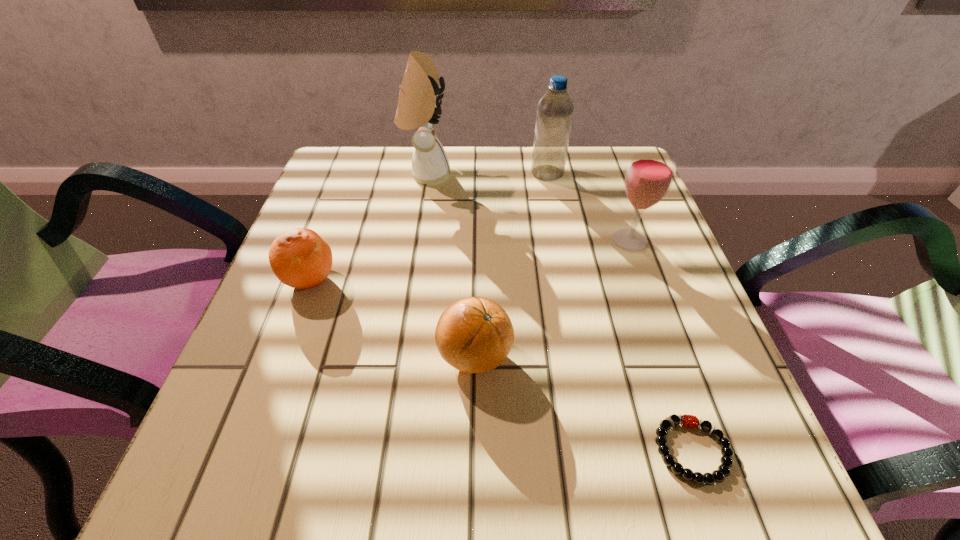
Where is `vacant point located between the water bottle and the nearest object`? The width and height of the screenshot is (960, 540). vacant point located between the water bottle and the nearest object is located at coordinates [x=620, y=312].

Identify the location of object that stands as the second closest to the right orange. (300, 258).

What are the coordinates of `object that is the fifth closest one to the fifth farthest object` in the screenshot? It's located at (555, 109).

Locate an element on the screen. This screenshot has width=960, height=540. vacant space that satisfies the following two spatial constraints: 1. at the front face of the doll; 2. on the back side of the wineglass is located at coordinates (417, 240).

I want to click on free spot that satisfies the following two spatial constraints: 1. at the front face of the shortest object; 2. on the right side of the doll, so click(x=384, y=450).

I want to click on free space that satisfies the following two spatial constraints: 1. at the front face of the fifth object from right to left; 2. on the left side of the fourth nearest object, so click(x=417, y=240).

Locate an element on the screen. vacant area in the image that satisfies the following two spatial constraints: 1. on the front side of the fifth shortest object; 2. on the right side of the wineglass is located at coordinates (560, 240).

You are a GUI agent. You are given a task and a screenshot of the screen. Output one action in this format:
    pyautogui.click(x=<x>, y=<y>)
    Task: Click on the free spot that satisfies the following two spatial constraints: 1. at the front face of the tallest object; 2. on the back side of the nearer orange
    
    Given the screenshot: What is the action you would take?
    pyautogui.click(x=398, y=356)